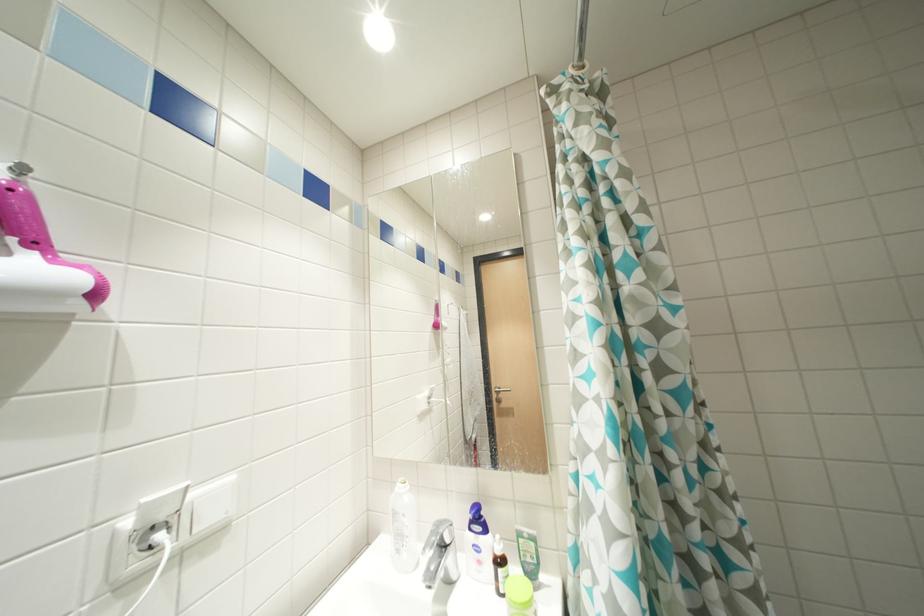
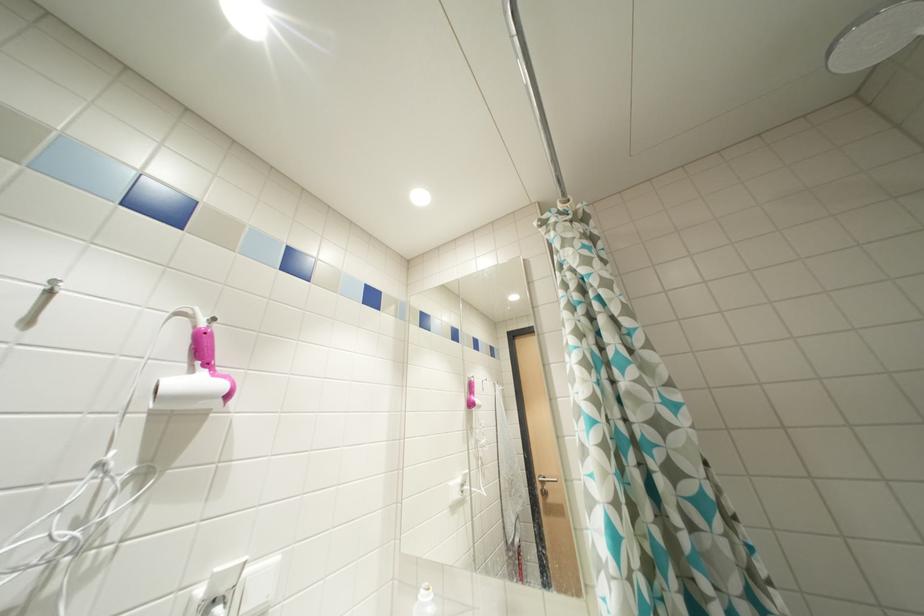
Question: The first image is from the beginning of the video and the second image is from the end. How did the camera likely rotate when shooting the video?

Choices:
 (A) Left
 (B) Right
 (C) Up
 (D) Down

Answer: (C)